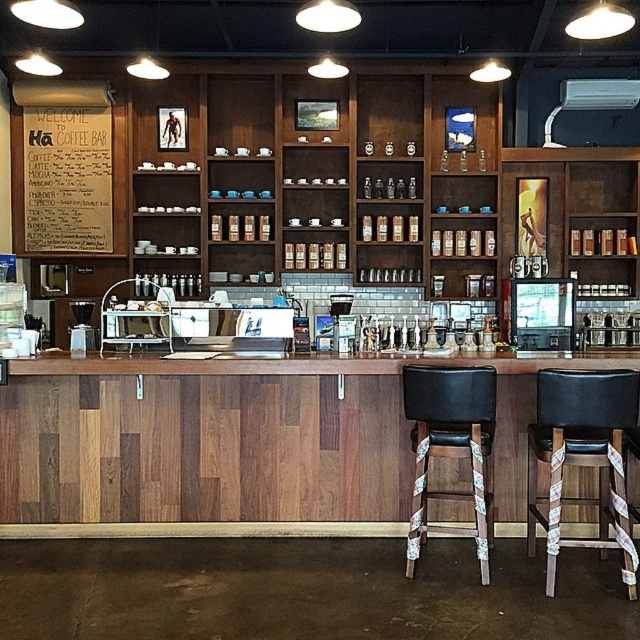
Question: Which point is farther to the camera?

Choices:
 (A) wooden menu board at upper left
 (B) metallic silver canisters at center
 (C) black leather stool at center
 (D) black leather stool at right

Answer: (B)

Question: Which point appears farthest from the camera in this image?

Choices:
 (A) pyautogui.click(x=413, y=550)
 (B) pyautogui.click(x=81, y=99)
 (C) pyautogui.click(x=572, y=252)
 (D) pyautogui.click(x=548, y=534)

Answer: (C)

Question: Is black leather stool at right in front of metallic silver canisters at center?

Choices:
 (A) no
 (B) yes

Answer: (B)

Question: Can you confirm if wooden menu board at upper left is positioned below metallic silver canisters at center?

Choices:
 (A) no
 (B) yes

Answer: (A)

Question: Is wooden menu board at upper left bigger than metallic silver canisters at center?

Choices:
 (A) no
 (B) yes

Answer: (B)

Question: Which object appears farthest from the camera in this image?

Choices:
 (A) metallic silver canisters at center
 (B) wooden menu board at upper left
 (C) black leather stool at right
 (D) black leather stool at center

Answer: (A)